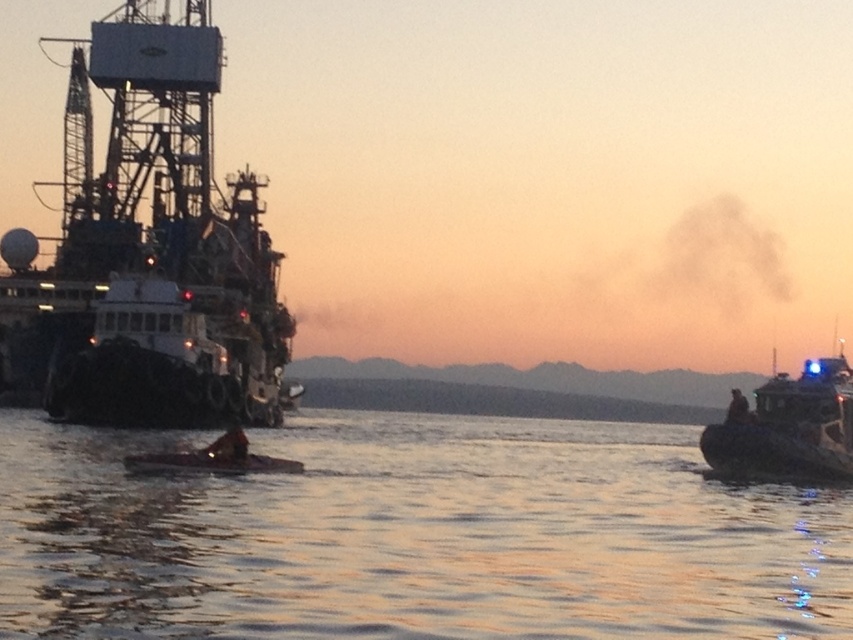
Is point (268, 572) in front of point (743, 419)?

Yes, it is.

Find the location of `smooth water at center`. smooth water at center is located at coordinates (413, 536).

Is smooth water at center smaller than white plastic boat at right?

No, smooth water at center is not smaller than white plastic boat at right.

Which is behind, point (511, 545) or point (724, 435)?

The point (724, 435) is behind.

Does point (473, 502) come behind point (801, 412)?

No, (473, 502) is in front of (801, 412).

Identify the location of smooth water at center. Image resolution: width=853 pixels, height=640 pixels. (413, 536).

Between smooth water at center and white matte ship at left, which one appears on the right side from the viewer's perspective?

smooth water at center is more to the right.

Describe the element at coordinates (413, 536) in the screenshot. I see `smooth water at center` at that location.

Find the location of a particular element. The height and width of the screenshot is (640, 853). smooth water at center is located at coordinates (413, 536).

The width and height of the screenshot is (853, 640). I want to click on smooth water at center, so click(x=413, y=536).